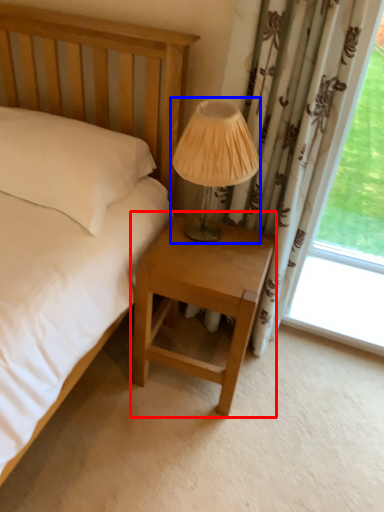
Question: Which object appears closest to the camera in this image, nightstand (highlighted by a red box) or table lamp (highlighted by a blue box)?

Choices:
 (A) nightstand
 (B) table lamp

Answer: (B)